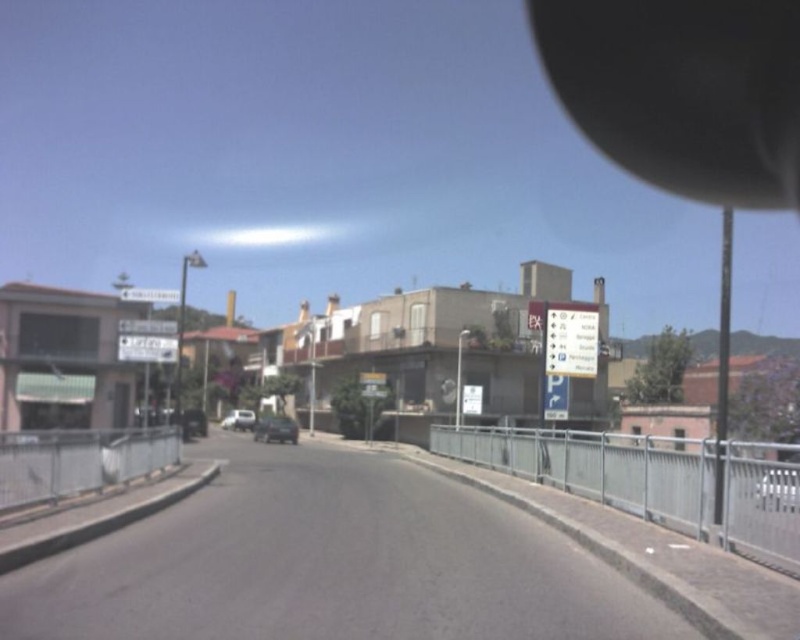
Locate an element on the screen. The height and width of the screenshot is (640, 800). metallic silver car at center is located at coordinates (276, 429).

Does metallic silver car at center appear on the right side of silver metallic car at center?

Yes, metallic silver car at center is to the right of silver metallic car at center.

What do you see at coordinates (276, 429) in the screenshot? I see `metallic silver car at center` at bounding box center [276, 429].

Where is `metallic silver car at center`? This screenshot has height=640, width=800. metallic silver car at center is located at coordinates 276,429.